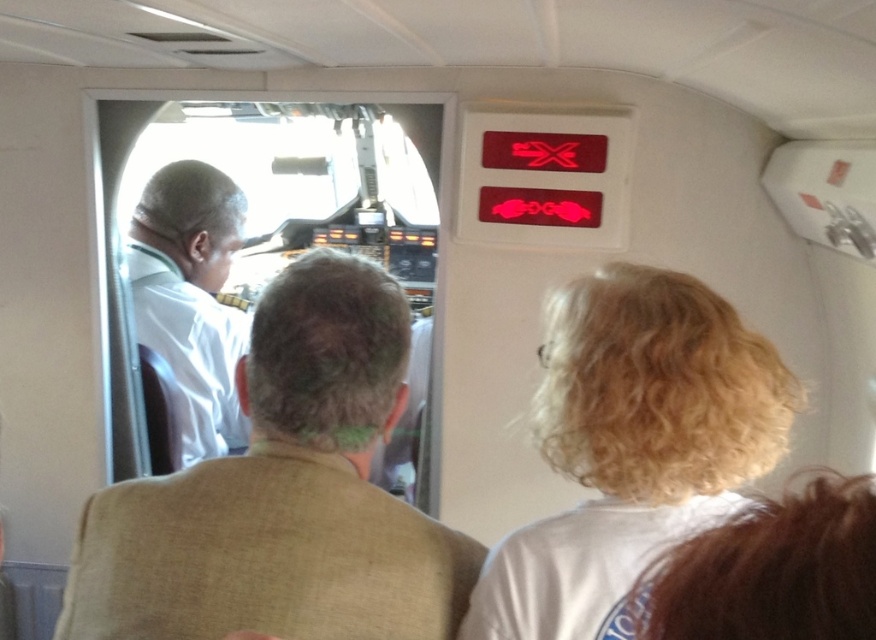
Question: Can you confirm if white curly hair at upper right is thinner than blonde curly hair at upper right?

Choices:
 (A) yes
 (B) no

Answer: (B)

Question: Estimate the real-world distances between objects in this image. Which object is farther from the blonde curly hair at upper right?

Choices:
 (A) white curly hair at upper right
 (B) white linen shirt at center
 (C) white shirt at left

Answer: (C)

Question: Estimate the real-world distances between objects in this image. Which object is closer to the white linen shirt at center?

Choices:
 (A) white curly hair at upper right
 (B) white shirt at left

Answer: (A)

Question: From the image, what is the correct spatial relationship of white curly hair at upper right in relation to blonde curly hair at upper right?

Choices:
 (A) below
 (B) above

Answer: (B)

Question: Observing the image, what is the correct spatial positioning of white curly hair at upper right in reference to white shirt at left?

Choices:
 (A) below
 (B) above

Answer: (A)

Question: Which point appears closest to the camera in this image?

Choices:
 (A) (778, 563)
 (B) (705, 376)
 (C) (193, 408)
 (D) (269, 470)

Answer: (A)